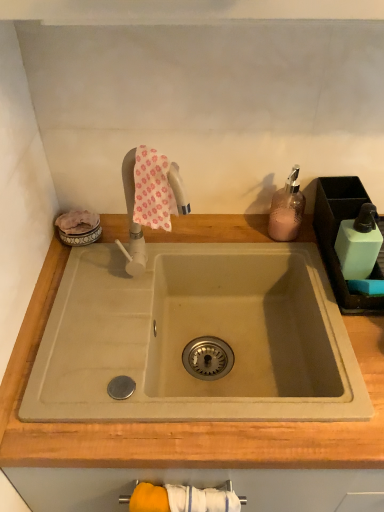
Question: Does beige wood countertop at center lie behind pink floral fabric at upper center?

Choices:
 (A) no
 (B) yes

Answer: (A)

Question: From a real-world perspective, is beige wood countertop at center located beneath pink floral fabric at upper center?

Choices:
 (A) yes
 (B) no

Answer: (A)

Question: Is beige wood countertop at center thinner than pink floral fabric at upper center?

Choices:
 (A) no
 (B) yes

Answer: (A)

Question: Does beige wood countertop at center have a smaller size compared to pink floral fabric at upper center?

Choices:
 (A) no
 (B) yes

Answer: (A)

Question: Is beige wood countertop at center placed right next to pink floral fabric at upper center?

Choices:
 (A) yes
 (B) no

Answer: (B)

Question: Relative to pink textured soap dispenser at upper right, is pink floral fabric at upper center in front or behind?

Choices:
 (A) behind
 (B) front

Answer: (B)

Question: In terms of size, does pink floral fabric at upper center appear bigger or smaller than pink textured soap dispenser at upper right?

Choices:
 (A) small
 (B) big

Answer: (A)

Question: Would you say pink floral fabric at upper center is to the left or to the right of pink textured soap dispenser at upper right in the picture?

Choices:
 (A) left
 (B) right

Answer: (A)

Question: From a real-world perspective, is pink floral fabric at upper center physically located above or below pink textured soap dispenser at upper right?

Choices:
 (A) below
 (B) above

Answer: (B)

Question: From the image's perspective, relative to light green plastic soap dispenser at right, is yellow fabric towel bar at lower center above or below?

Choices:
 (A) below
 (B) above

Answer: (A)

Question: Considering the positions of yellow fabric towel bar at lower center and light green plastic soap dispenser at right in the image, is yellow fabric towel bar at lower center wider or thinner than light green plastic soap dispenser at right?

Choices:
 (A) thin
 (B) wide

Answer: (A)

Question: Is yellow fabric towel bar at lower center in front of or behind light green plastic soap dispenser at right in the image?

Choices:
 (A) behind
 (B) front

Answer: (B)

Question: Considering the positions of yellow fabric towel bar at lower center and light green plastic soap dispenser at right in the image, is yellow fabric towel bar at lower center taller or shorter than light green plastic soap dispenser at right?

Choices:
 (A) short
 (B) tall

Answer: (B)

Question: From their relative heights in the image, would you say light green plastic soap dispenser at right is taller or shorter than yellow fabric towel bar at lower center?

Choices:
 (A) short
 (B) tall

Answer: (A)

Question: Considering the relative positions of light green plastic soap dispenser at right and yellow fabric towel bar at lower center in the image provided, is light green plastic soap dispenser at right to the left or to the right of yellow fabric towel bar at lower center?

Choices:
 (A) right
 (B) left

Answer: (A)